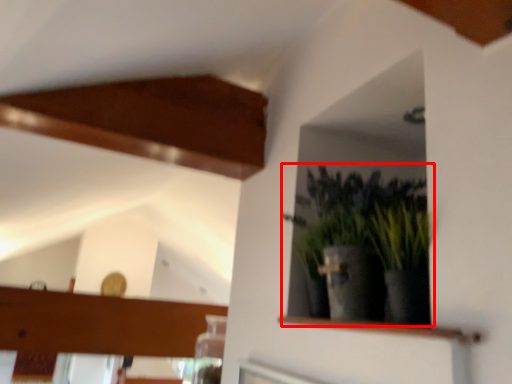
Question: In this image, where is houseplant (annotated by the red box) located relative to shelf?

Choices:
 (A) left
 (B) right

Answer: (B)